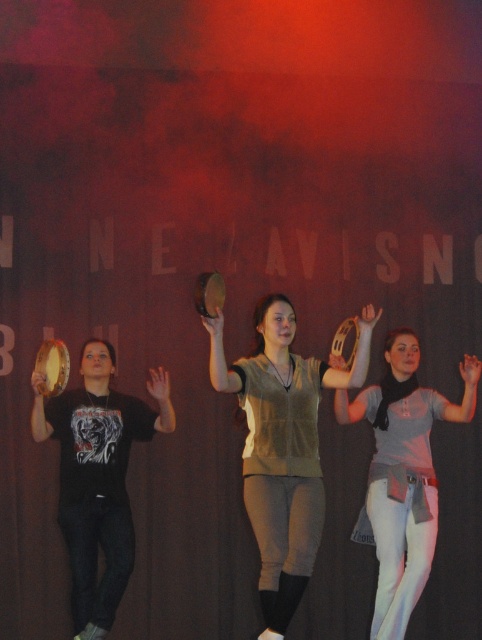
Question: Which object appears farthest from the camera in this image?

Choices:
 (A) velvet beige vest at center
 (B) light gray cotton shirt at center

Answer: (B)

Question: Can you confirm if velvet beige vest at center is positioned below light gray cotton shirt at center?

Choices:
 (A) yes
 (B) no

Answer: (B)

Question: Among these objects, which one is farthest from the camera?

Choices:
 (A) velvet beige vest at center
 (B) light gray cotton shirt at center

Answer: (B)

Question: From the image, what is the correct spatial relationship of velvet beige vest at center in relation to light gray cotton shirt at center?

Choices:
 (A) above
 (B) below

Answer: (A)

Question: Which point appears farthest from the camera in this image?

Choices:
 (A) (x=282, y=570)
 (B) (x=414, y=449)

Answer: (B)

Question: In this image, where is velvet beige vest at center located relative to light gray cotton shirt at center?

Choices:
 (A) right
 (B) left

Answer: (B)